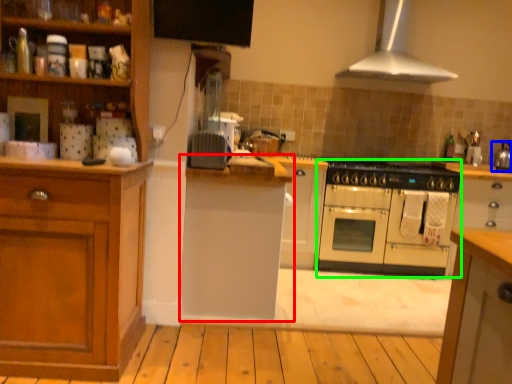
Question: Estimate the real-world distances between objects in this image. Which object is farther from cabinetry (highlighted by a red box), kitchen appliance (highlighted by a blue box) or oven (highlighted by a green box)?

Choices:
 (A) kitchen appliance
 (B) oven

Answer: (A)